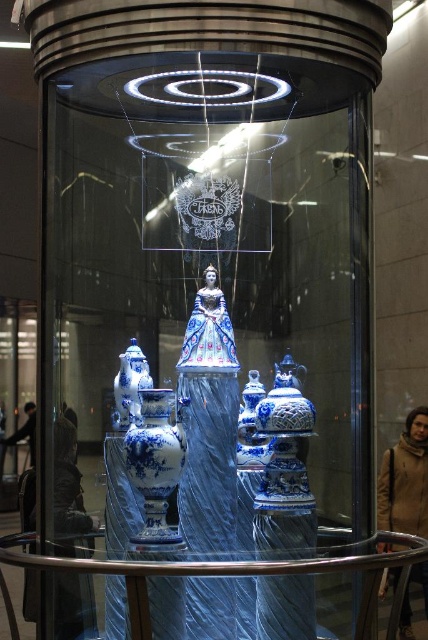
You are arranging a museum exhibit and need to place a decorative centerpiece on the transparent plastic table at center. However, you want to ensure it won not block the view of the blue glazed porcelain vase at left. Based on their positions, is this possible?

The transparent plastic table at center is positioned on the right side of the blue glazed porcelain vase at left, so placing a decorative centerpiece on the transparent plastic table at center would not block the view of the blue glazed porcelain vase at left since it is to the right of it.

You are an art curator planning to move the blue glazed porcelain vase at left closer to the blue porcelain vase at center. Considering their sizes, which one should you place in front to ensure both are visible?

The blue glazed porcelain vase at left is smaller in size than the blue porcelain vase at center. To ensure both are visible, place the smaller blue glazed porcelain vase at left in front of the larger one so it doesn not block the view of the larger vase.

You are standing in front of the display case and want to place a small decorative item on the transparent plastic table at center. Based on the display case layout, where exactly should you aim to place the item?

The transparent plastic table at center is located at the 2D coordinates point (237, 572), so you should aim for that specific point to place the small decorative item.